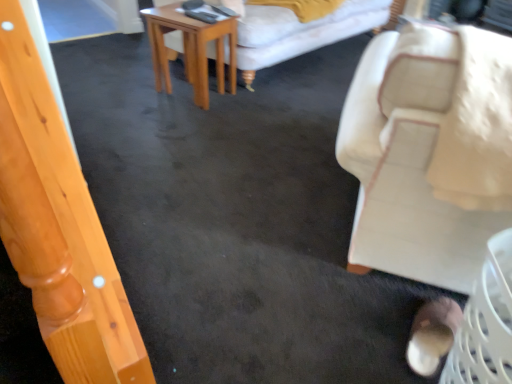
Question: Is beige fabric chair at right bigger or smaller than brown suede shoe at lower right?

Choices:
 (A) big
 (B) small

Answer: (A)

Question: Is point (419, 193) positioned closer to the camera than point (409, 352)?

Choices:
 (A) farther
 (B) closer

Answer: (B)

Question: Based on their relative distances, which object is nearer to the beige fabric chair at right?

Choices:
 (A) brown suede shoe at lower right
 (B) light brown wooden table at center

Answer: (A)

Question: Which object is the closest to the light brown wooden table at center?

Choices:
 (A) brown suede shoe at lower right
 (B) beige fabric chair at right

Answer: (B)